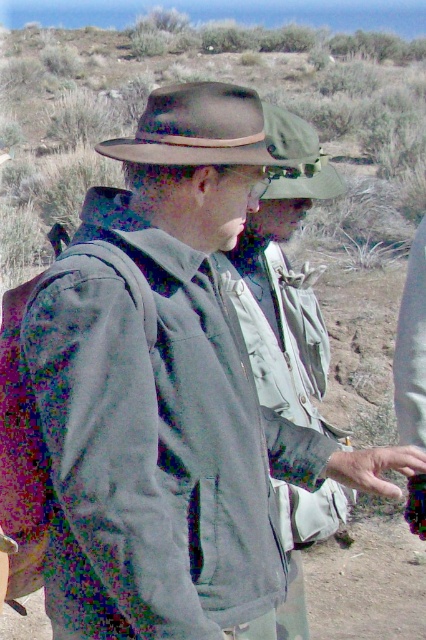
Question: Which object is the farthest from the green fabric cowboy hat at upper center?

Choices:
 (A) green matte jacket at center
 (B) matte brown cowboy hat at center

Answer: (A)

Question: Is matte brown cowboy hat at center behind green fabric cowboy hat at upper center?

Choices:
 (A) no
 (B) yes

Answer: (A)

Question: Estimate the real-world distances between objects in this image. Which object is farther from the green fabric cowboy hat at upper center?

Choices:
 (A) gray matte jacket at center
 (B) green matte jacket at center
 (C) matte brown cowboy hat at center

Answer: (A)

Question: Which point is farther to the camera?

Choices:
 (A) (158, 432)
 (B) (305, 192)

Answer: (B)

Question: Can you confirm if green matte jacket at center is bigger than green fabric cowboy hat at upper center?

Choices:
 (A) no
 (B) yes

Answer: (B)

Question: Considering the relative positions of green matte jacket at center and matte brown cowboy hat at center in the image provided, where is green matte jacket at center located with respect to matte brown cowboy hat at center?

Choices:
 (A) above
 (B) below

Answer: (B)